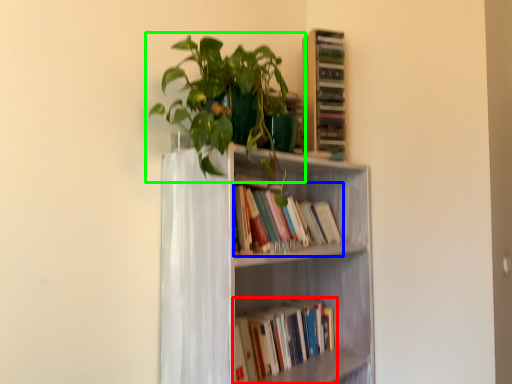
Question: Estimate the real-world distances between objects in this image. Which object is closer to book (highlighted by a red box), book (highlighted by a blue box) or houseplant (highlighted by a green box)?

Choices:
 (A) book
 (B) houseplant

Answer: (A)